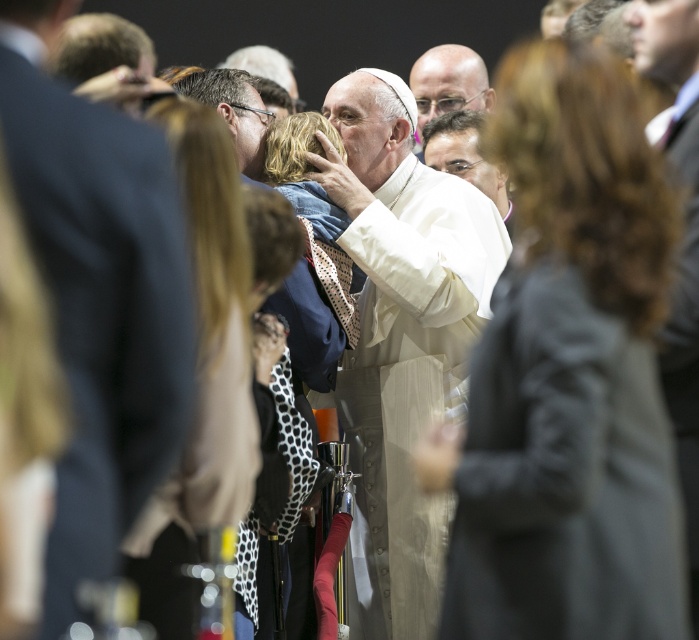
Is point (210, 236) in front of point (468, 80)?

Yes, point (210, 236) is in front of point (468, 80).

Does polka dot fabric at center have a smaller size compared to clear plastic glasses at upper center?

Yes, polka dot fabric at center is smaller than clear plastic glasses at upper center.

Is point (199, 484) less distant than point (456, 68)?

Yes, it is in front of point (456, 68).

Where is `polka dot fabric at center`? polka dot fabric at center is located at coordinates (201, 374).

Between point (570, 112) and point (245, 250), which one is positioned in front?

Point (245, 250) is more forward.

Is dark gray coat at center to the right of polka dot fabric at center from the viewer's perspective?

Correct, you'll find dark gray coat at center to the right of polka dot fabric at center.

Locate an element on the screen. dark gray coat at center is located at coordinates (568, 376).

Which is below, dark gray coat at center or light brown leather jacket at center?

→ dark gray coat at center is lower down.

Does dark gray coat at center have a smaller size compared to light brown leather jacket at center?

Indeed, dark gray coat at center has a smaller size compared to light brown leather jacket at center.

Does point (496, 74) lie in front of point (459, 125)?

No, it is not.

Find the location of a particular element. The height and width of the screenshot is (640, 699). dark gray coat at center is located at coordinates (568, 376).